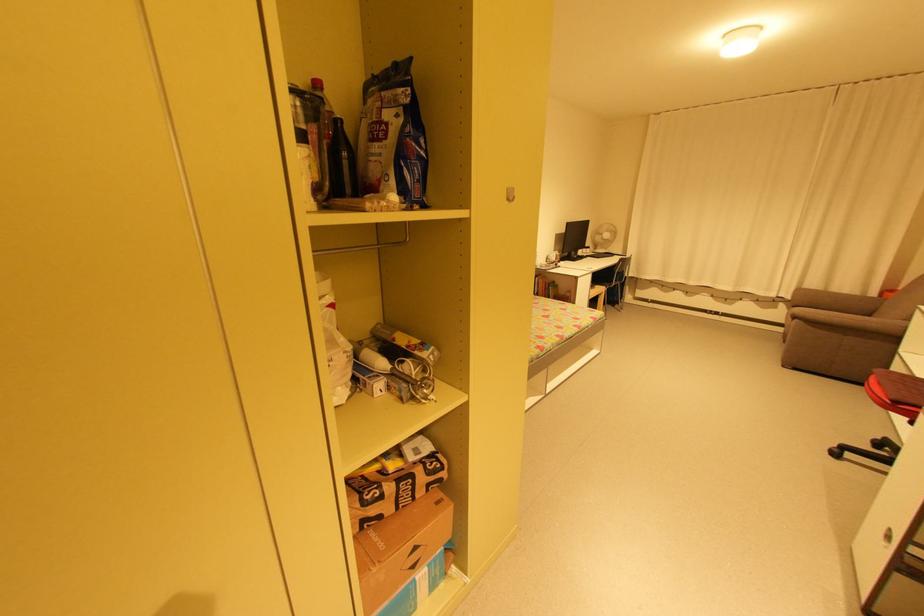
Find where to lift the white electric fan. Please return your answer as a coordinate pair (x, y).

(602, 236)